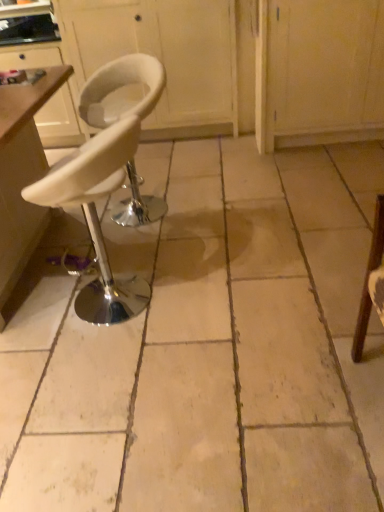
This screenshot has width=384, height=512. Find the location of `free space behind white matte stool at center, which is the first chair from back to front`. free space behind white matte stool at center, which is the first chair from back to front is located at coordinates (167, 175).